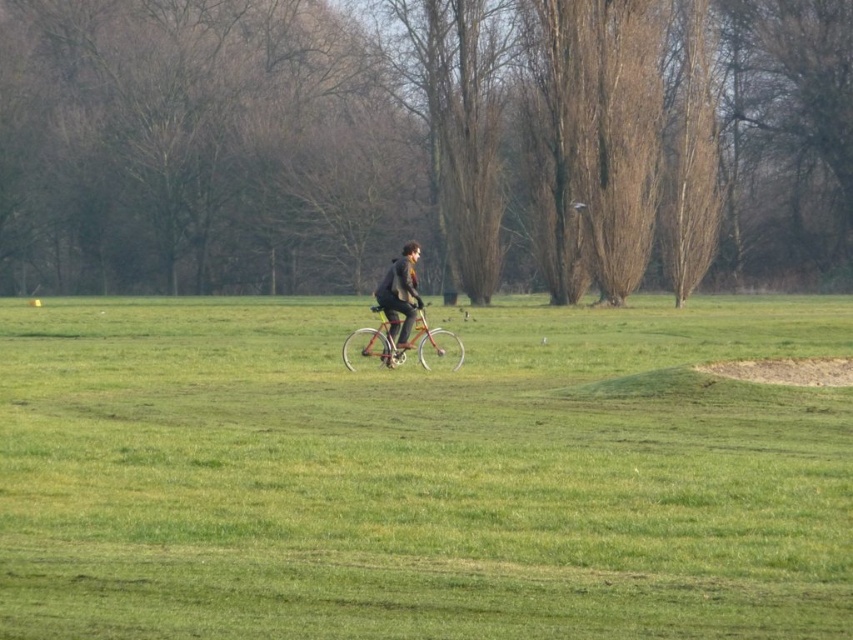
Can you confirm if metallic silver bicycle at center is bigger than dark brown leather jacket at center?

Indeed, metallic silver bicycle at center has a larger size compared to dark brown leather jacket at center.

Is the position of metallic silver bicycle at center less distant than that of dark brown leather jacket at center?

Yes, it is in front of dark brown leather jacket at center.

Does point (379, 323) come behind point (415, 317)?

Yes, point (379, 323) is farther from viewer.

Where is `metallic silver bicycle at center`? This screenshot has width=853, height=640. metallic silver bicycle at center is located at coordinates (373, 344).

Does green grass at center appear over dark brown leather jacket at center?

Actually, green grass at center is below dark brown leather jacket at center.

Which of these two, green grass at center or dark brown leather jacket at center, stands shorter?

With less height is dark brown leather jacket at center.

Which is behind, point (708, 406) or point (410, 323)?

Positioned behind is point (410, 323).

At what (x,y) coordinates should I click in order to perform the action: click on green grass at center. Please return your answer as a coordinate pair (x, y). This screenshot has width=853, height=640. Looking at the image, I should click on (421, 474).

Which is behind, point (164, 390) or point (440, 352)?

The point (440, 352) is behind.

Is green grass at center closer to the viewer compared to metallic silver bicycle at center?

Yes, it is in front of metallic silver bicycle at center.

At what (x,y) coordinates should I click in order to perform the action: click on green grass at center. Please return your answer as a coordinate pair (x, y). Looking at the image, I should click on (421, 474).

The height and width of the screenshot is (640, 853). I want to click on green grass at center, so click(421, 474).